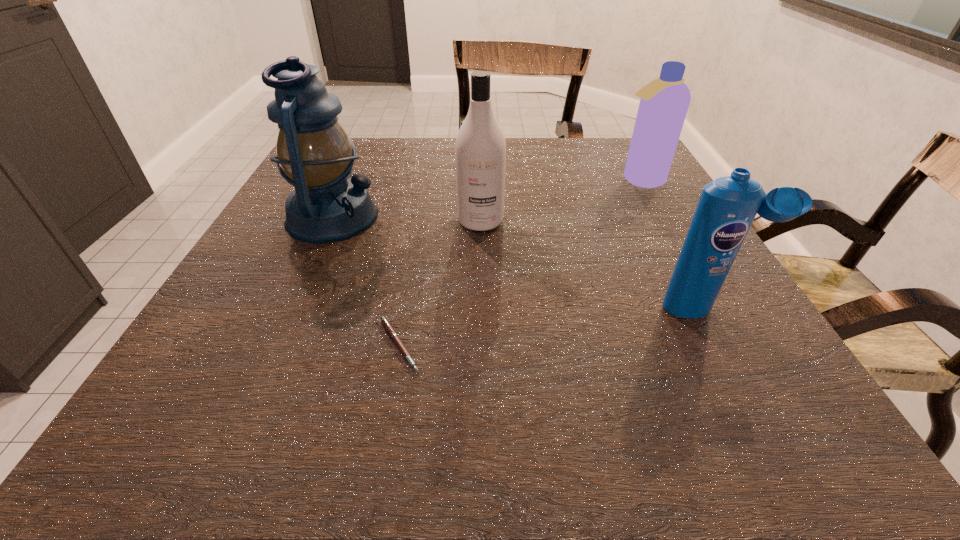
This screenshot has width=960, height=540. In order to click on object that is the fourth nearest to the shortest object in this screenshot , I will do `click(664, 102)`.

The image size is (960, 540). I want to click on shampoo that stands as the third closest to the lantern, so click(x=664, y=102).

Locate which shampoo is the closest to the shortest object. Please provide its 2D coordinates. Your answer should be formatted as a tuple, i.e. [(x, y)], where the tuple contains the x and y coordinates of a point satisfying the conditions above.

[(480, 150)]

Identify the location of vacant area that satisfies the following two spatial constraints: 1. on the front side of the nearest shampoo; 2. at the nib of the shortest object. The image size is (960, 540). (726, 345).

You are a GUI agent. You are given a task and a screenshot of the screen. Output one action in this format:
    pyautogui.click(x=<x>, y=<y>)
    Task: Click on the vacant space that satisfies the following two spatial constraints: 1. on the front side of the farthest shampoo; 2. at the nib of the pen
    This screenshot has width=960, height=540.
    Given the screenshot: What is the action you would take?
    pos(732,345)

The height and width of the screenshot is (540, 960). What are the coordinates of `free space that satisfies the following two spatial constraints: 1. on the face of the nearest shampoo; 2. on the right side of the lantern` in the screenshot? It's located at point(291,308).